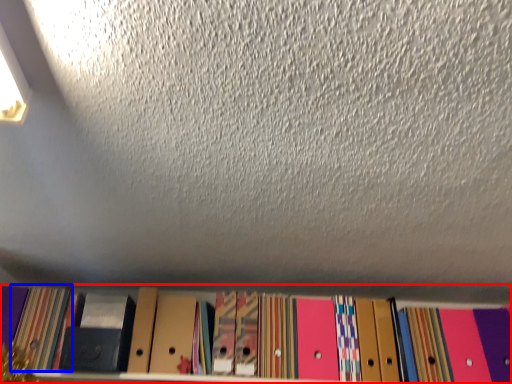
Question: Which object appears closest to the camera in this image, shelf (highlighted by a red box) or paperback book (highlighted by a blue box)?

Choices:
 (A) shelf
 (B) paperback book

Answer: (A)